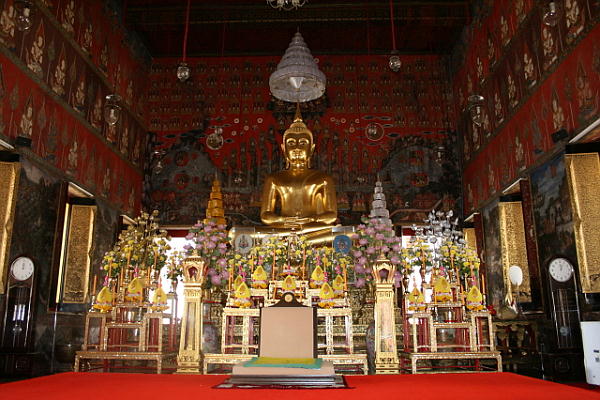
This screenshot has height=400, width=600. Identify the location of red walls. (410, 103), (117, 111), (553, 102).